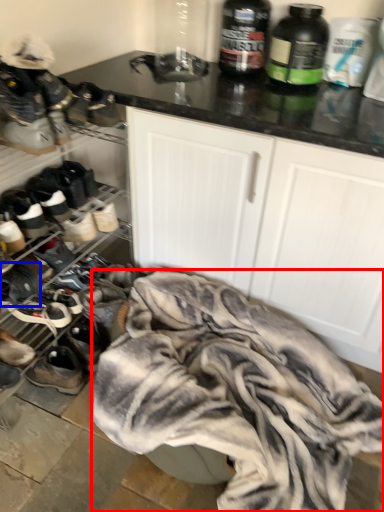
Question: Among these objects, which one is farthest to the camera, clothing (highlighted by a red box) or footwear (highlighted by a blue box)?

Choices:
 (A) clothing
 (B) footwear

Answer: (B)